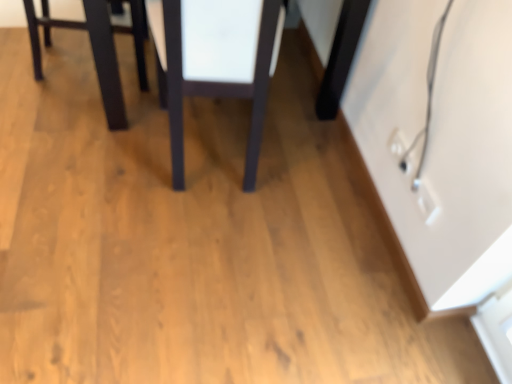
What is the approximate height of matte black table at upper left?

14.39 inches.

Measure the distance between matte black table at upper left and camera.

matte black table at upper left is 1.31 meters from camera.

You are a GUI agent. You are given a task and a screenshot of the screen. Output one action in this format:
    pyautogui.click(x=<x>, y=<y>)
    Task: Click on the matte black table at upper left
    
    Given the screenshot: What is the action you would take?
    pyautogui.click(x=97, y=49)

Describe the element at coordinates (97, 49) in the screenshot. I see `matte black table at upper left` at that location.

The width and height of the screenshot is (512, 384). What do you see at coordinates (216, 62) in the screenshot?
I see `matte dark wood table at center` at bounding box center [216, 62].

What is the approximate height of matte dark wood table at center?

matte dark wood table at center is 26.45 inches tall.

Measure the distance between matte dark wood table at center and camera.

matte dark wood table at center is 1.04 meters away from camera.

The height and width of the screenshot is (384, 512). Find the location of `matte dark wood table at center`. matte dark wood table at center is located at coordinates (216, 62).

You are a GUI agent. You are given a task and a screenshot of the screen. Output one action in this format:
    pyautogui.click(x=<x>, y=<y>)
    Task: Click on the matte black table at upper left
    
    Given the screenshot: What is the action you would take?
    pyautogui.click(x=97, y=49)

In the scene shown: Can you confirm if matte dark wood table at center is positioned to the left of matte black table at upper left?

No.

Who is more distant, matte dark wood table at center or matte black table at upper left?

matte black table at upper left is further away from the camera.

Considering the positions of point (234, 58) and point (110, 123), is point (234, 58) closer or farther from the camera than point (110, 123)?

Point (234, 58) is positioned closer to the camera compared to point (110, 123).

From the image's perspective, is matte dark wood table at center located above or below matte black table at upper left?

From the image's perspective, matte dark wood table at center appears below matte black table at upper left.

From a real-world perspective, is matte dark wood table at center located beneath matte black table at upper left?

No, from a real-world perspective, matte dark wood table at center is not beneath matte black table at upper left.

Considering the sizes of matte dark wood table at center and matte black table at upper left in the image, is matte dark wood table at center wider or thinner than matte black table at upper left?

Clearly, matte dark wood table at center has more width compared to matte black table at upper left.

In terms of height, does matte dark wood table at center look taller or shorter compared to matte black table at upper left?

matte dark wood table at center is taller than matte black table at upper left.

Which of these two, matte dark wood table at center or matte black table at upper left, is bigger?

With larger size is matte dark wood table at center.

Would you say matte dark wood table at center contains matte black table at upper left?

No, matte black table at upper left is not a part of matte dark wood table at center.

Are matte dark wood table at center and matte black table at upper left beside each other?

There is a gap between matte dark wood table at center and matte black table at upper left.

Is matte dark wood table at center positioned with its back to matte black table at upper left?

No, matte dark wood table at center is not facing away from matte black table at upper left.

How different are the orientations of matte dark wood table at center and matte black table at upper left in degrees?

There is a 85.9-degree angle between the facing directions of matte dark wood table at center and matte black table at upper left.

How far apart are matte dark wood table at center and matte black table at upper left?

A distance of 12.98 inches exists between matte dark wood table at center and matte black table at upper left.

Identify the location of table located on the right of matte black table at upper left. The height and width of the screenshot is (384, 512). (216, 62).

Is matte black table at upper left to the left or to the right of matte dark wood table at center in the image?

Based on their positions, matte black table at upper left is located to the left of matte dark wood table at center.

In the image, is matte black table at upper left positioned in front of or behind matte dark wood table at center?

Clearly, matte black table at upper left is behind matte dark wood table at center.

Is point (86, 27) less distant than point (157, 29)?

That is True.

From the image's perspective, which object appears higher, matte black table at upper left or matte dark wood table at center?

From the image's view, matte black table at upper left is above.

From a real-world perspective, is matte black table at upper left positioned under matte dark wood table at center based on gravity?

Yes, from a real-world perspective, matte black table at upper left is beneath matte dark wood table at center.

Which of these two, matte black table at upper left or matte dark wood table at center, is wider?

matte dark wood table at center.

Between matte black table at upper left and matte dark wood table at center, which one has more height?

matte dark wood table at center.

Considering the relative sizes of matte black table at upper left and matte dark wood table at center in the image provided, is matte black table at upper left smaller than matte dark wood table at center?

Yes, matte black table at upper left is smaller than matte dark wood table at center.

Is matte black table at upper left completely or partially outside of matte dark wood table at center?

Yes.

Can you see matte black table at upper left touching matte dark wood table at center?

No, matte black table at upper left is not making contact with matte dark wood table at center.

Could you tell me if matte black table at upper left is turned towards matte dark wood table at center?

No, matte black table at upper left is not turned towards matte dark wood table at center.

How many degrees apart are the facing directions of matte black table at upper left and matte dark wood table at center?

matte black table at upper left and matte dark wood table at center are facing 85.9 degrees away from each other.

How far apart are matte black table at upper left and matte dark wood table at center?

matte black table at upper left is 12.98 inches from matte dark wood table at center.

Identify the location of furniture to the left of matte dark wood table at center. (97, 49).

Identify the location of table on the right of matte black table at upper left. The image size is (512, 384). (216, 62).

Image resolution: width=512 pixels, height=384 pixels. In order to click on furniture on the left of matte dark wood table at center in this screenshot , I will do `click(97, 49)`.